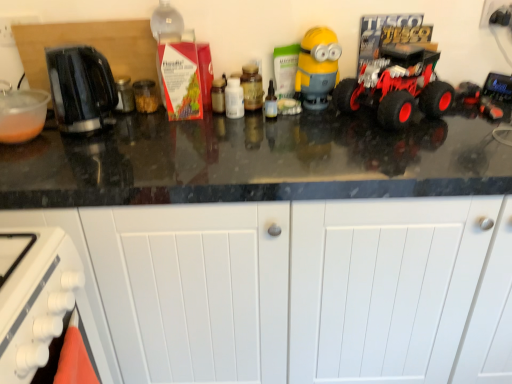
The image size is (512, 384). What are the coordinates of `vacant area that lies in front of black plastic toaster at left` in the screenshot? It's located at (77, 153).